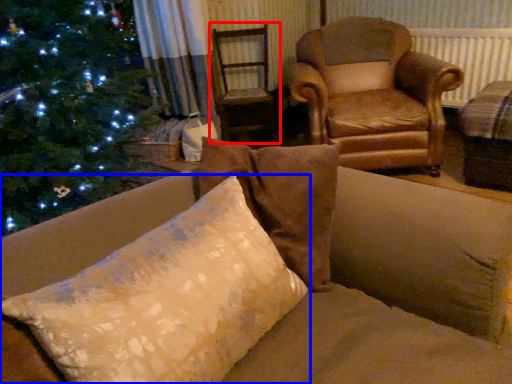
Question: Which object appears closest to the camera in this image, swivel chair (highlighted by a red box) or pillow (highlighted by a blue box)?

Choices:
 (A) swivel chair
 (B) pillow

Answer: (B)